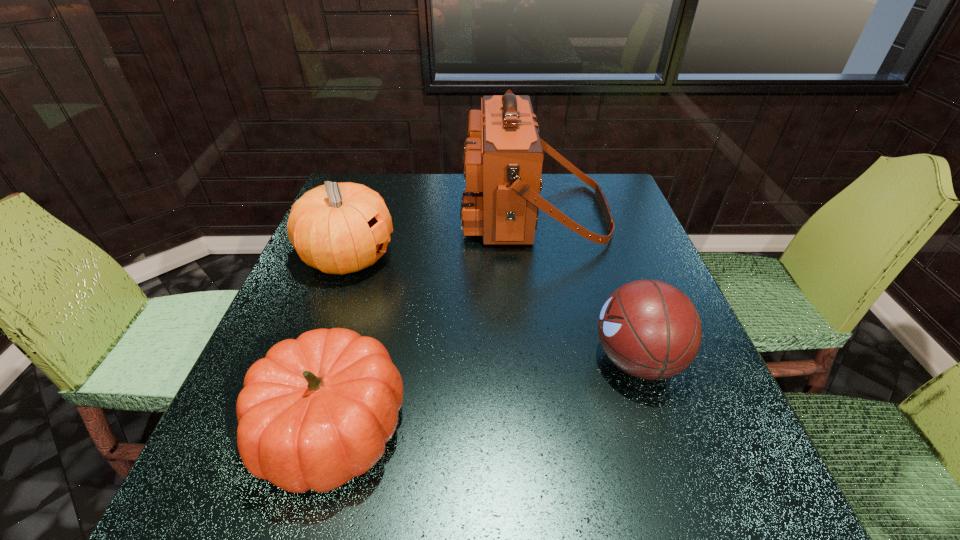
Where is `vacant area at the far left corner`? This screenshot has height=540, width=960. vacant area at the far left corner is located at coordinates (386, 187).

Find the location of a particular element. The width and height of the screenshot is (960, 540). vacant region at the near left corner of the desktop is located at coordinates (193, 528).

Find the location of a particular element. The width and height of the screenshot is (960, 540). vacant space at the far right corner is located at coordinates (617, 205).

I want to click on free point between the basketball and the tallest object, so click(586, 286).

Where is `free space between the basketball and the farther pumpkin`? This screenshot has height=540, width=960. free space between the basketball and the farther pumpkin is located at coordinates (492, 309).

Find the location of `free point between the nearer pumpkin and the tallest object`. free point between the nearer pumpkin and the tallest object is located at coordinates (433, 320).

This screenshot has width=960, height=540. In order to click on free space between the basketball and the satchel in this screenshot , I will do `click(586, 286)`.

Where is `vacant area that lies between the nearer pumpkin and the satchel`? vacant area that lies between the nearer pumpkin and the satchel is located at coordinates (433, 320).

I want to click on empty location between the taller pumpkin and the basketball, so click(492, 309).

At what (x,y) coordinates should I click in order to perform the action: click on vacant space that's between the farther pumpkin and the basketball. Please return your answer as a coordinate pair (x, y). This screenshot has height=540, width=960. Looking at the image, I should click on (492, 309).